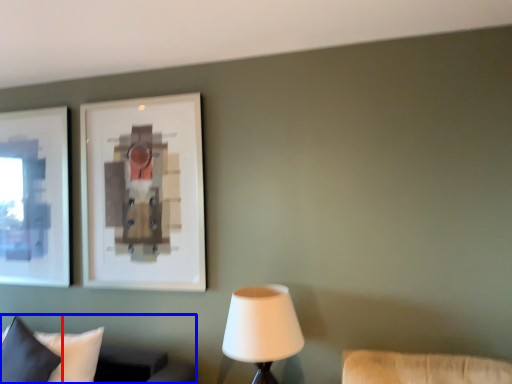
Question: Which of the following is the farthest to the observer, pillow (highlighted by a red box) or furniture (highlighted by a blue box)?

Choices:
 (A) pillow
 (B) furniture

Answer: (B)